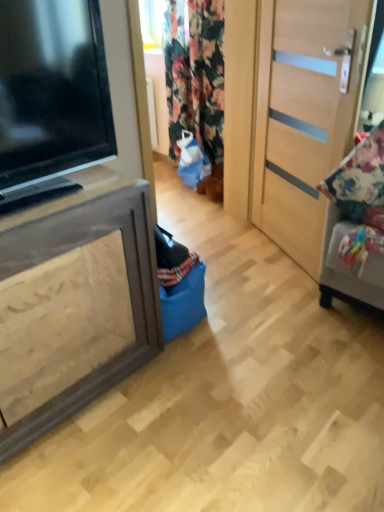
Locate an element on the screen. The width and height of the screenshot is (384, 512). vacant area in front of light wood door at right is located at coordinates 281,302.